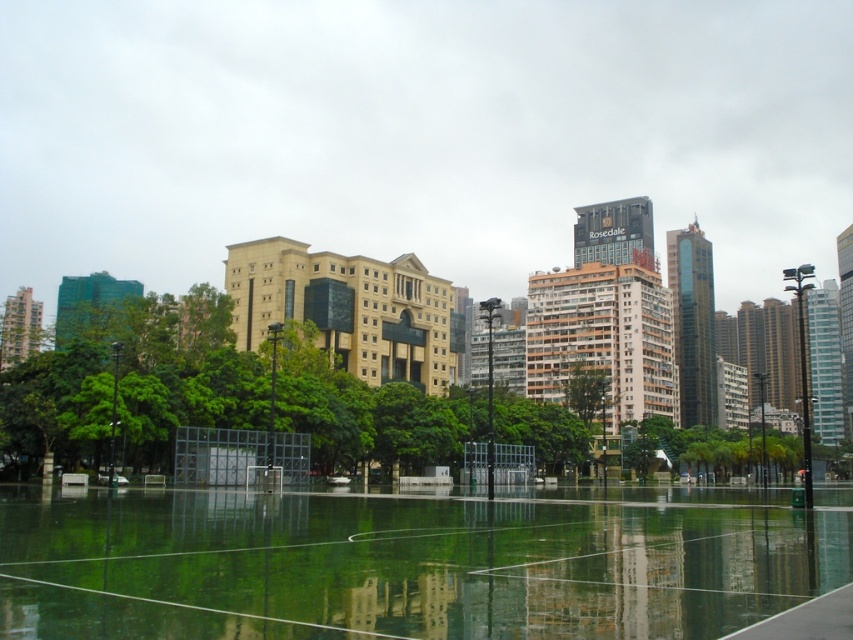
Question: Is transparent glass court at center smaller than green leafy tree at center?

Choices:
 (A) no
 (B) yes

Answer: (B)

Question: Does transparent glass court at center appear under green leafy tree at center?

Choices:
 (A) no
 (B) yes

Answer: (A)

Question: Among these objects, which one is farthest from the camera?

Choices:
 (A) transparent glass court at center
 (B) green leafy tree at center

Answer: (B)

Question: Which point appears farthest from the camera in this image?

Choices:
 (A) (630, 576)
 (B) (306, 336)

Answer: (B)

Question: Which point is farther to the camera?

Choices:
 (A) (811, 584)
 (B) (183, 406)

Answer: (B)

Question: Can you confirm if transparent glass court at center is positioned to the left of green leafy tree at center?

Choices:
 (A) no
 (B) yes

Answer: (B)